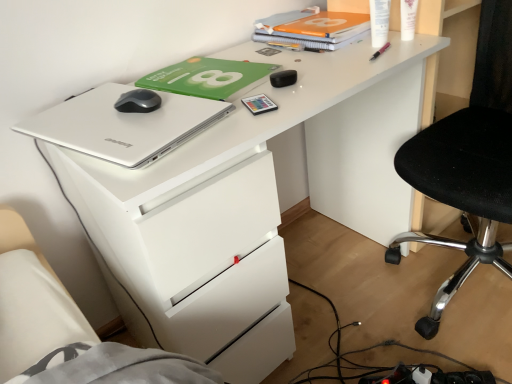
Where is `space that is in front of pink plastic pen at upper right, which appears as the third stationery when viewed from the top`? The width and height of the screenshot is (512, 384). space that is in front of pink plastic pen at upper right, which appears as the third stationery when viewed from the top is located at coordinates (372, 68).